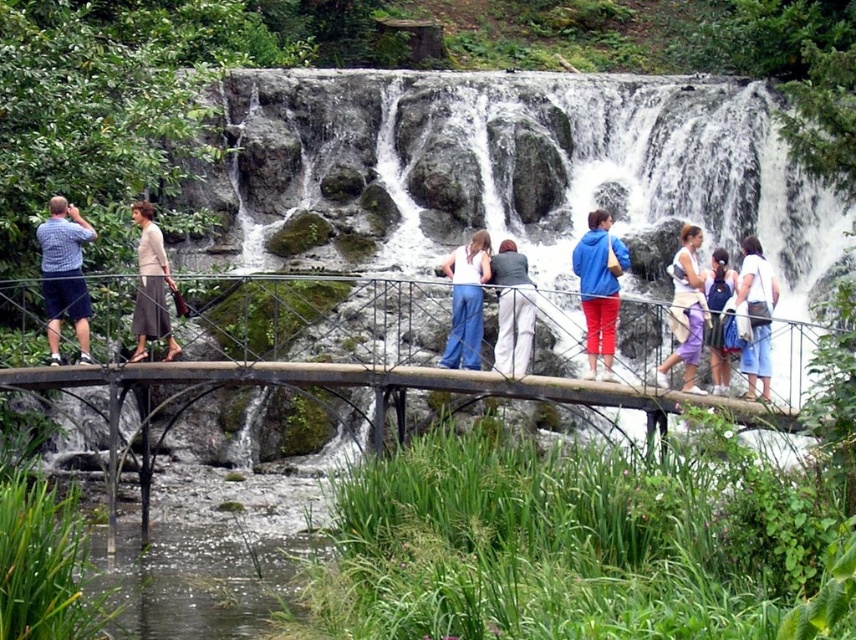
You are standing on the metal suspension bridge and want to take a photo of the waterfall. There are two points on the bridge where you can stand to frame your shot. The first point is at coordinates point (525, 305), and the second is at point (729, 273). Which point is closer to the waterfall?

Point (525, 305) is in front of point (729, 273), so it is closer to the waterfall.

You are standing on the suspension bridge and see a point at coordinates (152, 285). Which object is this point located on?

The point at coordinates (152, 285) is located on the matte gray skirt at left.

You are a photographer planning to take a photo of the green grassy creek at lower left and the white cotton dress at center. Which object should you focus on if you want to capture the larger subject in your shot?

The white cotton dress at center should be focused on because it occupies more space than the green grassy creek at lower left.